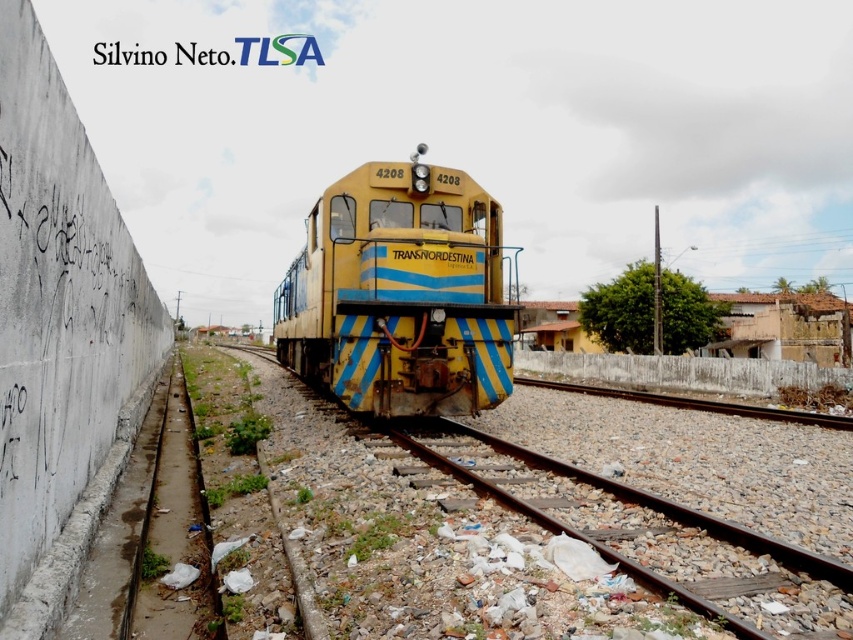
You are a passenger waiting at the railway station and see the yellow matte train at center and the rusty metal train track at center. Which object is closer to the concrete wall on the left side of the frame?

The yellow matte train at center is closer to the concrete wall on the left side of the frame because it is positioned to the left of the rusty metal train track at center, which is further away from the wall.

You are a railway engineer planning to place a new signal box exactly at point 0.459, 0.470. Is there enough space to place it there without interfering with the yellow matte train at center?

The yellow matte train at center is already positioned at point [399,292], so placing the signal box there would interfere with the train. Choose a different location.